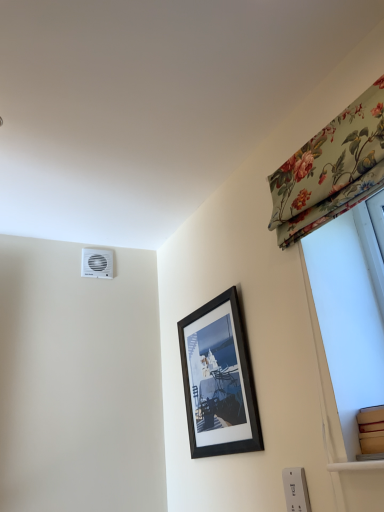
Question: Is there a large distance between white plastic air conditioning unit at upper left and floral fabric curtain at upper right?

Choices:
 (A) yes
 (B) no

Answer: (A)

Question: From a real-world perspective, is white plastic air conditioning unit at upper left on floral fabric curtain at upper right?

Choices:
 (A) no
 (B) yes

Answer: (B)

Question: Does white plastic air conditioning unit at upper left contain floral fabric curtain at upper right?

Choices:
 (A) yes
 (B) no

Answer: (B)

Question: Does white plastic air conditioning unit at upper left appear on the right side of floral fabric curtain at upper right?

Choices:
 (A) no
 (B) yes

Answer: (A)

Question: Is white plastic air conditioning unit at upper left turned away from floral fabric curtain at upper right?

Choices:
 (A) yes
 (B) no

Answer: (B)

Question: In terms of width, does black matte picture frame at center look wider or thinner when compared to white plastic air conditioning unit at upper left?

Choices:
 (A) wide
 (B) thin

Answer: (A)

Question: From their relative heights in the image, would you say black matte picture frame at center is taller or shorter than white plastic air conditioning unit at upper left?

Choices:
 (A) short
 (B) tall

Answer: (B)

Question: Visually, is black matte picture frame at center positioned to the left or to the right of white plastic air conditioning unit at upper left?

Choices:
 (A) right
 (B) left

Answer: (A)

Question: Would you say black matte picture frame at center is inside or outside white plastic air conditioning unit at upper left?

Choices:
 (A) inside
 (B) outside

Answer: (B)

Question: From the image's perspective, is white plastic electric outlet at lower right located above or below black matte picture frame at center?

Choices:
 (A) above
 (B) below

Answer: (B)

Question: In terms of width, does white plastic electric outlet at lower right look wider or thinner when compared to black matte picture frame at center?

Choices:
 (A) thin
 (B) wide

Answer: (A)

Question: Do you think white plastic electric outlet at lower right is within black matte picture frame at center, or outside of it?

Choices:
 (A) inside
 (B) outside

Answer: (B)

Question: Considering the relative positions of white plastic electric outlet at lower right and black matte picture frame at center in the image provided, is white plastic electric outlet at lower right to the left or to the right of black matte picture frame at center?

Choices:
 (A) left
 (B) right

Answer: (B)

Question: Is white plastic electric outlet at lower right inside the boundaries of floral fabric curtain at upper right, or outside?

Choices:
 (A) outside
 (B) inside

Answer: (A)

Question: In the image, is white plastic electric outlet at lower right positioned in front of or behind floral fabric curtain at upper right?

Choices:
 (A) behind
 (B) front

Answer: (A)